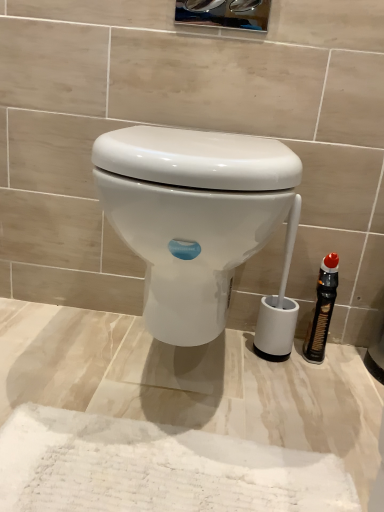
Question: Does black plastic bottle at right appear on the left side of white glossy toilet at center?

Choices:
 (A) no
 (B) yes

Answer: (A)

Question: Is black plastic bottle at right far from white glossy toilet at center?

Choices:
 (A) yes
 (B) no

Answer: (B)

Question: Does black plastic bottle at right have a smaller size compared to white glossy toilet at center?

Choices:
 (A) no
 (B) yes

Answer: (B)

Question: From the image's perspective, is black plastic bottle at right located beneath white glossy toilet at center?

Choices:
 (A) yes
 (B) no

Answer: (A)

Question: From the image's perspective, is black plastic bottle at right above white glossy toilet at center?

Choices:
 (A) yes
 (B) no

Answer: (B)

Question: Considering the relative sizes of black plastic bottle at right and white glossy toilet at center in the image provided, is black plastic bottle at right wider than white glossy toilet at center?

Choices:
 (A) yes
 (B) no

Answer: (B)

Question: Is white glossy toilet at center with black plastic bottle at right?

Choices:
 (A) yes
 (B) no

Answer: (B)

Question: Is white glossy toilet at center not close to black plastic bottle at right?

Choices:
 (A) yes
 (B) no

Answer: (B)

Question: Considering the relative sizes of white glossy toilet at center and black plastic bottle at right in the image provided, is white glossy toilet at center smaller than black plastic bottle at right?

Choices:
 (A) yes
 (B) no

Answer: (B)

Question: Can you confirm if white glossy toilet at center is thinner than black plastic bottle at right?

Choices:
 (A) yes
 (B) no

Answer: (B)

Question: Can you confirm if white glossy toilet at center is positioned to the left of black plastic bottle at right?

Choices:
 (A) yes
 (B) no

Answer: (A)

Question: Is white glossy toilet at center closer to camera compared to black plastic bottle at right?

Choices:
 (A) no
 (B) yes

Answer: (B)

Question: Does point (334, 270) appear closer or farther from the camera than point (228, 287)?

Choices:
 (A) farther
 (B) closer

Answer: (B)